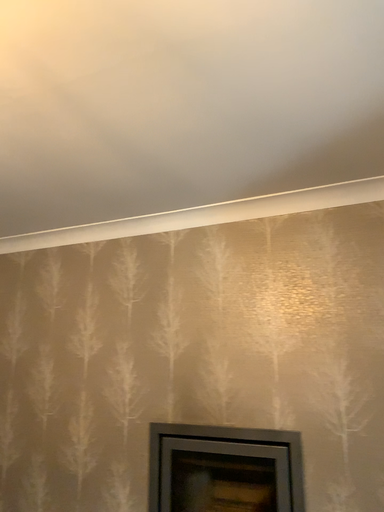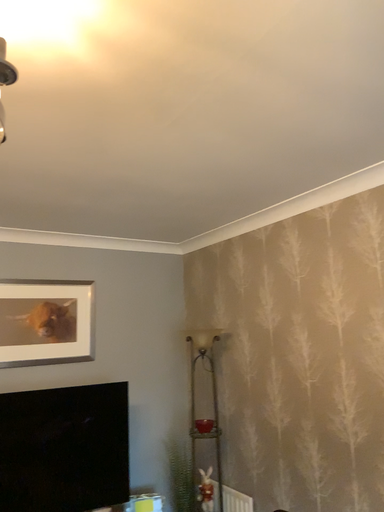
Question: How did the camera likely rotate when shooting the video?

Choices:
 (A) rotated right
 (B) rotated left

Answer: (B)